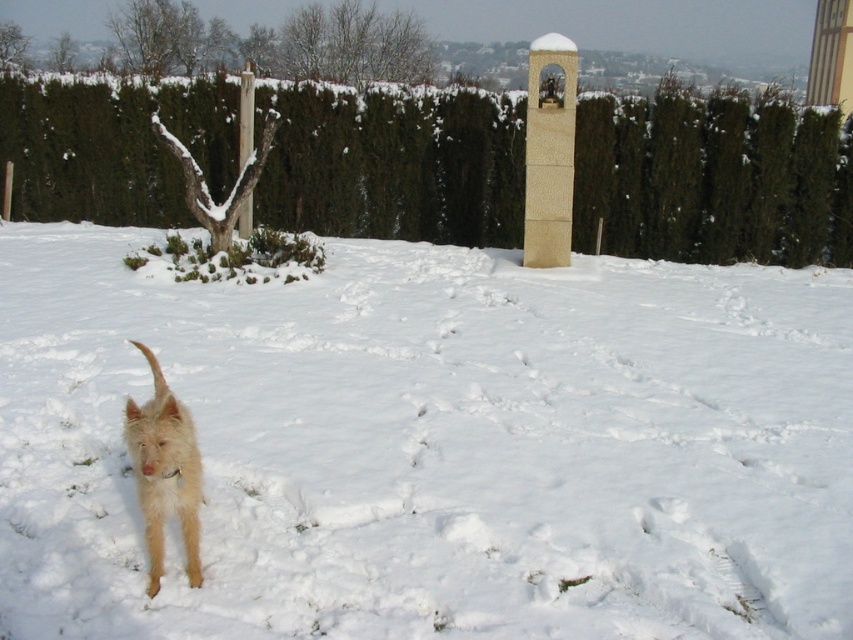
Question: Does green hedge at upper center appear on the left side of fuzzy beige dog at lower left?

Choices:
 (A) yes
 (B) no

Answer: (B)

Question: Does green hedge at upper center appear over fuzzy beige dog at lower left?

Choices:
 (A) no
 (B) yes

Answer: (B)

Question: Does green hedge at upper center lie in front of fuzzy beige dog at lower left?

Choices:
 (A) yes
 (B) no

Answer: (B)

Question: Which object is closer to the camera taking this photo?

Choices:
 (A) white fluffy snow at center
 (B) green hedge at upper center
 (C) fuzzy beige dog at lower left

Answer: (C)

Question: Which point is farther to the camera?

Choices:
 (A) (577, 582)
 (B) (195, 513)
 (C) (610, 250)

Answer: (C)

Question: Which point is closer to the camera?

Choices:
 (A) white fluffy snow at center
 (B) fuzzy beige dog at lower left
 (C) green hedge at upper center

Answer: (B)